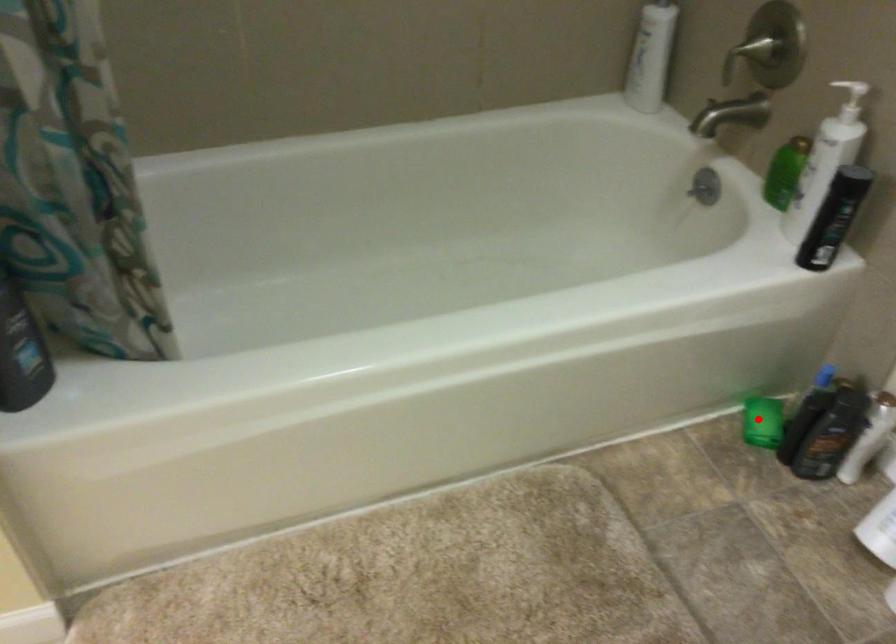
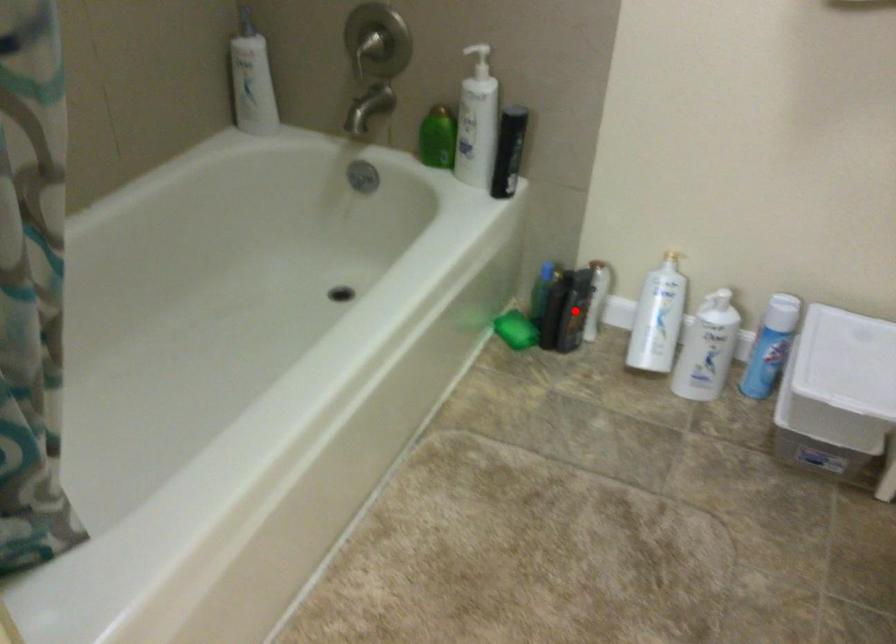
I am providing you with two images of the same scene from different viewpoints. A red point is marked on the first image and another point is marked on the second image. Is the marked point in image1 the same physical position as the marked point in image2?

No